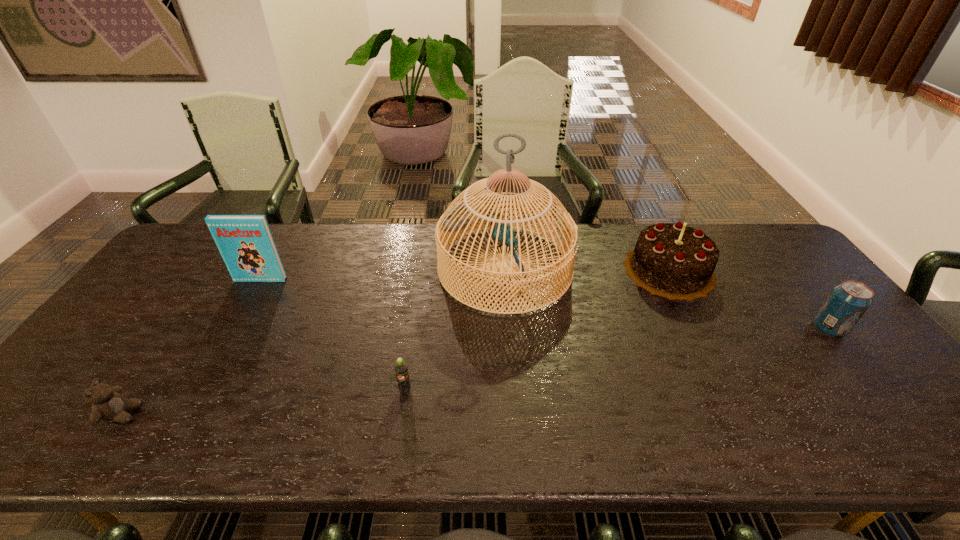
The height and width of the screenshot is (540, 960). Find the location of `vacant space at the far right corner of the desktop`. vacant space at the far right corner of the desktop is located at coordinates (725, 232).

At what (x,y) coordinates should I click in order to perform the action: click on free area in between the left soda and the book. Please return your answer as a coordinate pair (x, y). Image resolution: width=960 pixels, height=540 pixels. Looking at the image, I should click on (333, 335).

The width and height of the screenshot is (960, 540). I want to click on vacant area that lies between the book and the nearest object, so click(192, 347).

At what (x,y) coordinates should I click in order to perform the action: click on vacant area between the book and the rightmost object. Please return your answer as a coordinate pair (x, y). The height and width of the screenshot is (540, 960). Looking at the image, I should click on 544,304.

Where is `free area in between the third object from right to left and the rightmost object`? This screenshot has height=540, width=960. free area in between the third object from right to left and the rightmost object is located at coordinates (667, 298).

The image size is (960, 540). In order to click on unoccupied position between the fourth tallest object and the leftmost object in this screenshot , I will do 476,371.

I want to click on vacant area that lies between the taller soda and the fourth object from right to left, so [617, 359].

Locate an element on the screen. This screenshot has width=960, height=540. free space that is in between the fourth object from left to right and the fifth farthest object is located at coordinates (455, 329).

Where is `free spot between the fifth shortest object and the nearest object`? This screenshot has width=960, height=540. free spot between the fifth shortest object and the nearest object is located at coordinates (192, 347).

At what (x,y) coordinates should I click in order to perform the action: click on vacant point located between the second nearest object and the nearest object. Please return your answer as a coordinate pair (x, y). Looking at the image, I should click on (264, 402).